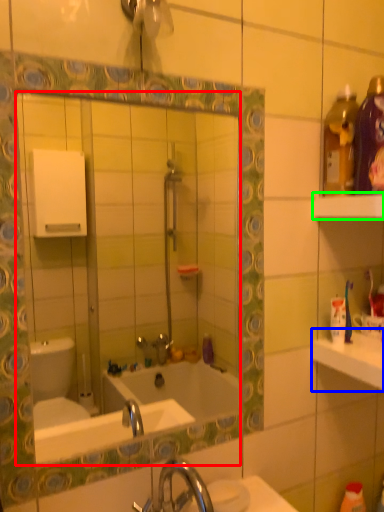
Question: Which is farther away from mirror (highlighted by a red box)? counter top (highlighted by a blue box) or shelf (highlighted by a green box)?

Choices:
 (A) counter top
 (B) shelf

Answer: (B)